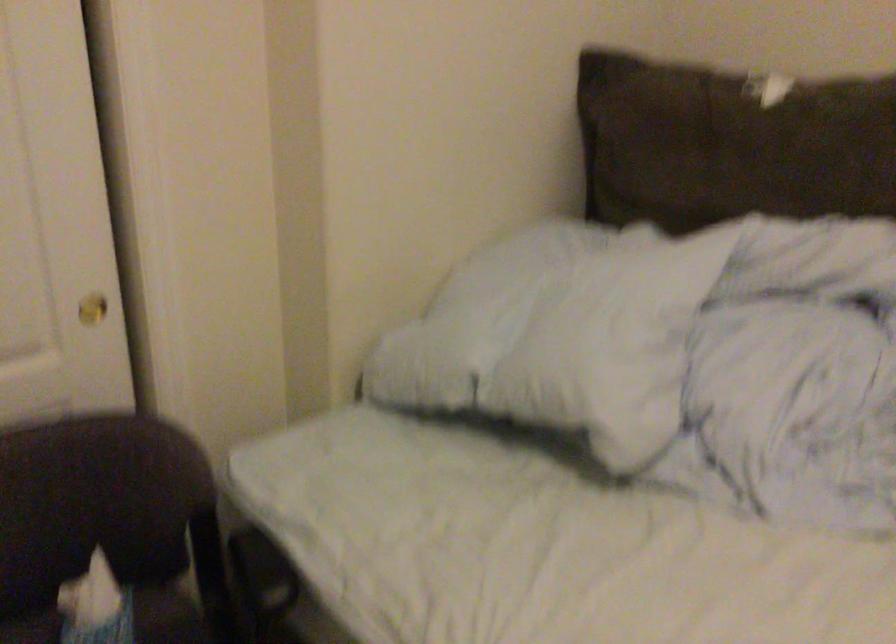
How did the camera likely rotate?

The camera's rotation is toward right-down.